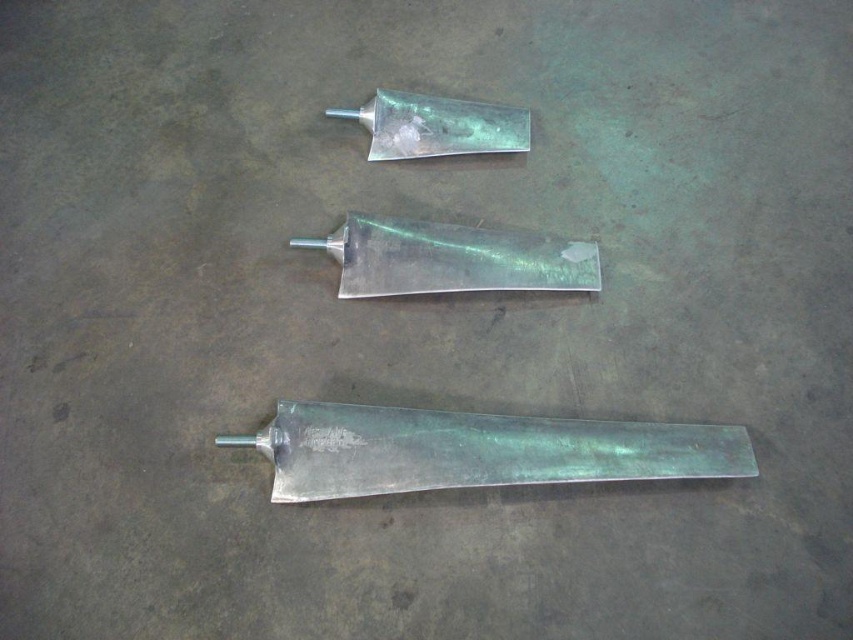
Question: Is metallic silver razor at center thinner than shiny silver razor at center?

Choices:
 (A) yes
 (B) no

Answer: (B)

Question: Among these objects, which one is farthest from the camera?

Choices:
 (A) metallic silver razor at center
 (B) shiny silver razor at center

Answer: (B)

Question: Does metallic silver razor at bottom have a greater width compared to shiny silver razor at center?

Choices:
 (A) yes
 (B) no

Answer: (A)

Question: Is metallic silver razor at center behind shiny silver razor at center?

Choices:
 (A) yes
 (B) no

Answer: (B)

Question: Which point appears farthest from the camera in this image?

Choices:
 (A) (381, 257)
 (B) (672, 452)
 (C) (386, 113)

Answer: (C)

Question: Which point is farther to the camera?

Choices:
 (A) (387, 227)
 (B) (403, 426)

Answer: (A)